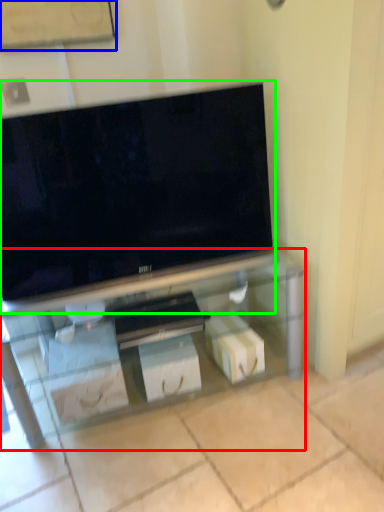
Question: Considering the real-world distances, which object is farthest from furniture (highlighted by a red box)? bulletin board (highlighted by a blue box) or television (highlighted by a green box)?

Choices:
 (A) bulletin board
 (B) television

Answer: (A)